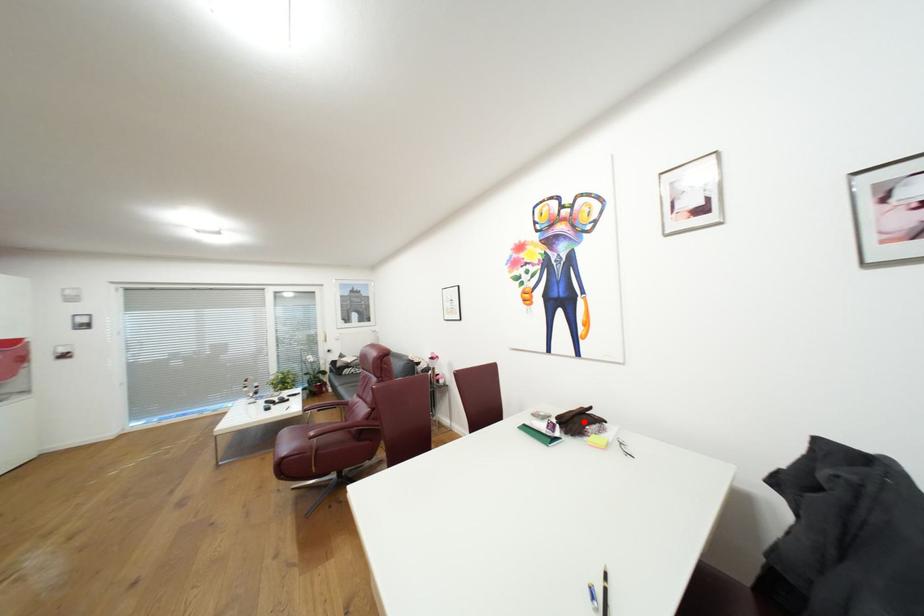
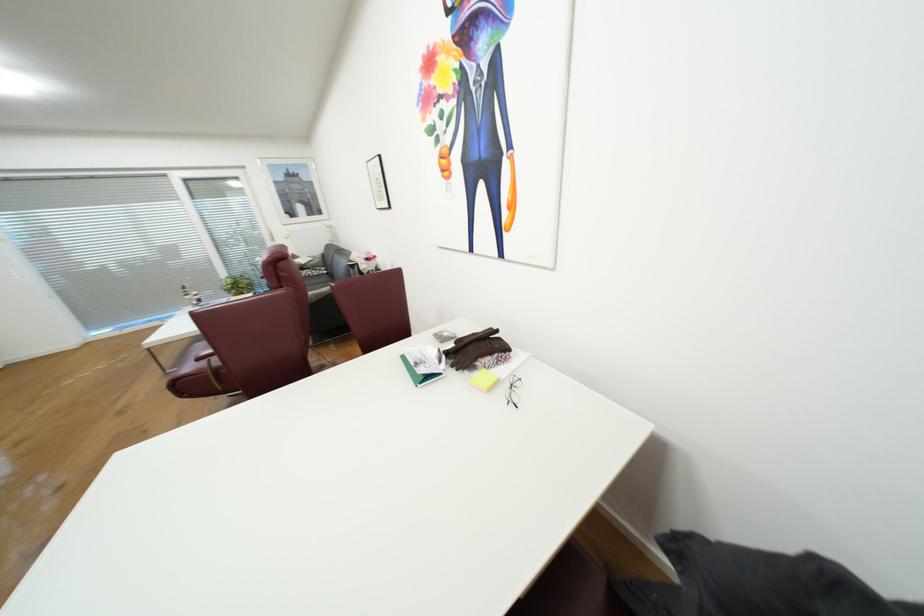
In the second image, find the point that corresponds to the highlighted location in the first image.

(481, 350)